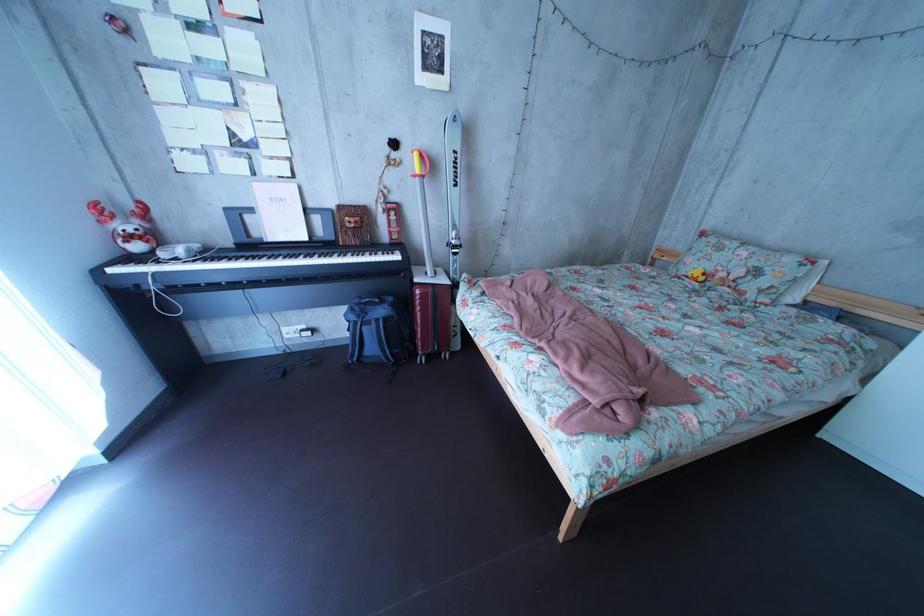
The image size is (924, 616). I want to click on spiral-bound book, so click(353, 225).